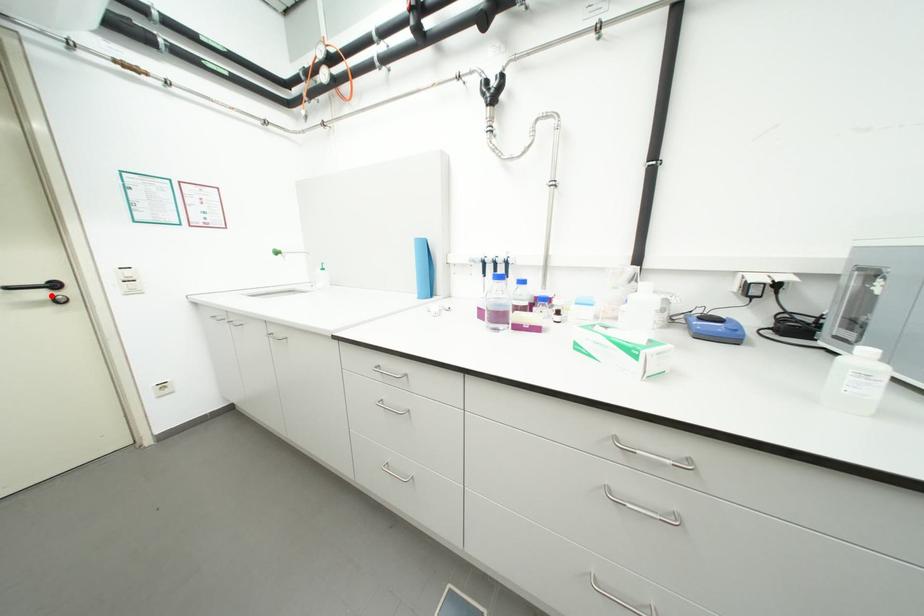
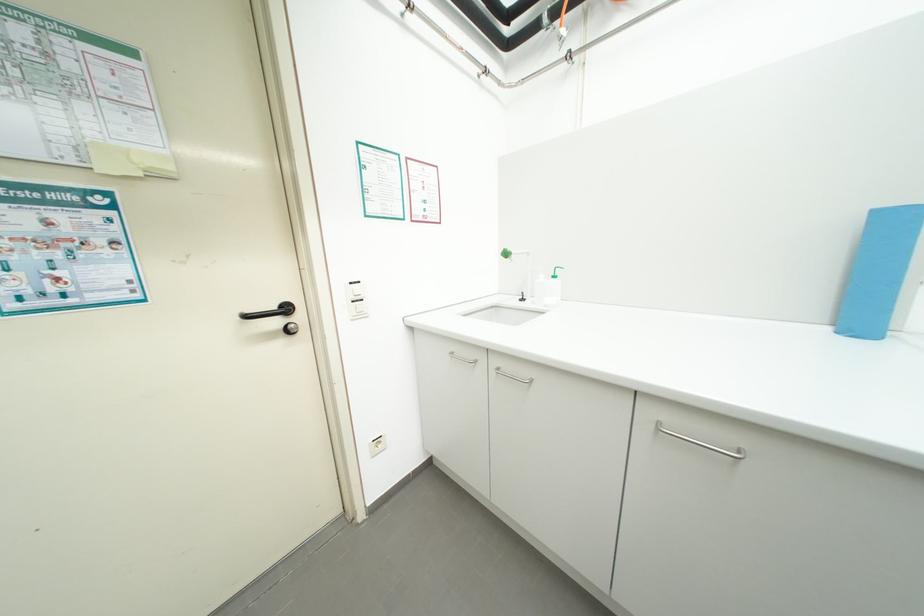
Question: I am providing you with two images of the same scene from different viewpoints. Image1 has a red point marked. In image2, the corresponding 3D location appears at what relative position? Reply with the corresponding letter.

Choices:
 (A) Closer
 (B) Farther

Answer: (A)